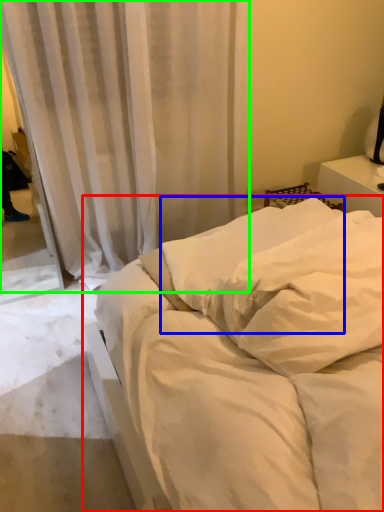
Question: Estimate the real-world distances between objects in this image. Which object is closer to bed (highlighted by a red box), pillow (highlighted by a blue box) or curtain (highlighted by a green box)?

Choices:
 (A) pillow
 (B) curtain

Answer: (A)